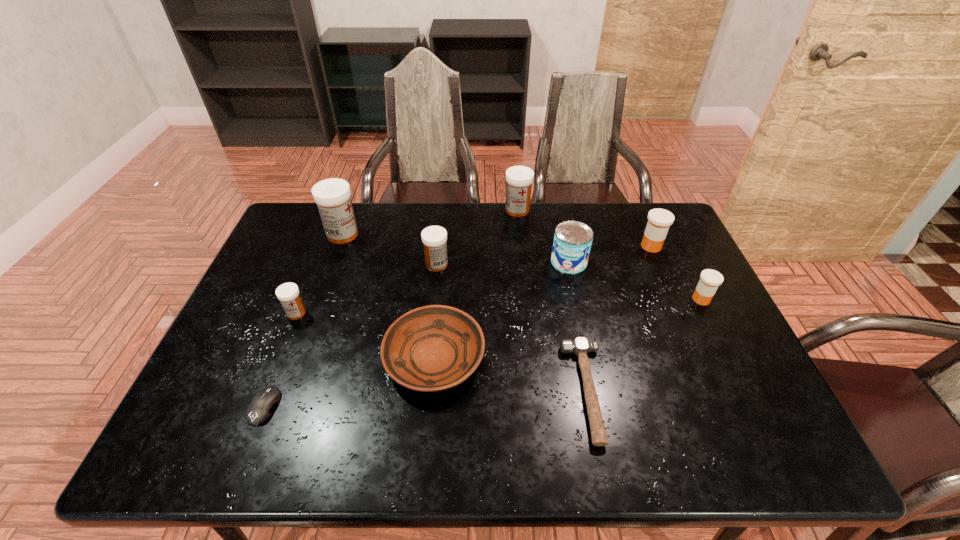
Identify the location of free location located 0.050m on the label of the second object from right to left. click(624, 246).

This screenshot has height=540, width=960. Identify the location of vacant area situated on the front of the fourth farthest medicine. (429, 335).

This screenshot has height=540, width=960. I want to click on free space located 0.230m on the right of the blue can, so click(661, 262).

Find the location of `free space located on the label of the smaller orange medicine`. free space located on the label of the smaller orange medicine is located at coordinates click(x=560, y=299).

Locate an element on the screen. This screenshot has width=960, height=540. vacant region located 0.380m on the label of the smaller orange medicine is located at coordinates (557, 299).

Where is `free space located 0.160m on the label of the smaller orange medicine`? This screenshot has width=960, height=540. free space located 0.160m on the label of the smaller orange medicine is located at coordinates (635, 299).

At what (x,y) coordinates should I click in order to perform the action: click on vacant space located 0.310m on the right of the nearest white medicine. Please return your answer as a coordinate pair (x, y). The width and height of the screenshot is (960, 540). Looking at the image, I should click on (420, 313).

Where is `vacant space situated on the left of the eighth tallest object`? vacant space situated on the left of the eighth tallest object is located at coordinates (276, 358).

Where is `vacant space situated on the striking face of the hammer`? The height and width of the screenshot is (540, 960). vacant space situated on the striking face of the hammer is located at coordinates coord(482,392).

Locate an element on the screen. free space located on the striking face of the hammer is located at coordinates click(x=478, y=392).